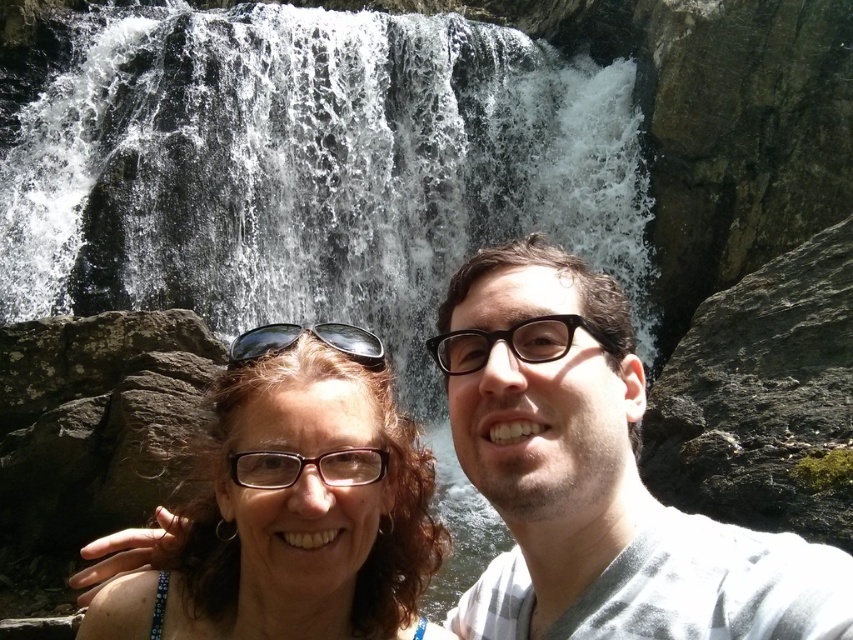
Question: Does white frothy water at center appear under smooth gray shirt at center?

Choices:
 (A) no
 (B) yes

Answer: (A)

Question: Among these objects, which one is farthest from the camera?

Choices:
 (A) matte brown hair at center
 (B) white frothy water at center
 (C) smooth gray shirt at center

Answer: (B)

Question: Can you confirm if white frothy water at center is positioned above matte brown hair at center?

Choices:
 (A) yes
 (B) no

Answer: (A)

Question: Is smooth gray shirt at center behind matte brown hair at center?

Choices:
 (A) yes
 (B) no

Answer: (B)

Question: Estimate the real-world distances between objects in this image. Which object is closer to the matte brown hair at center?

Choices:
 (A) white frothy water at center
 (B) smooth gray shirt at center

Answer: (B)

Question: Which point is closer to the camera?

Choices:
 (A) (410, 408)
 (B) (469, 282)
 (C) (253, 616)

Answer: (C)